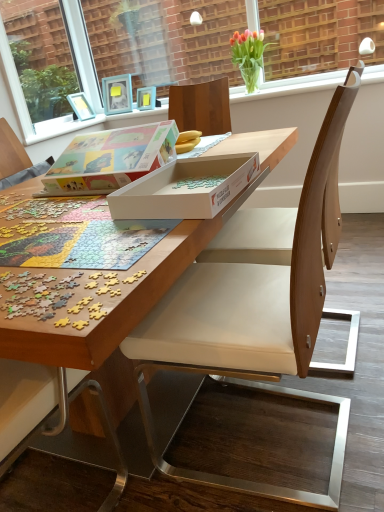
Question: Which direction should I rotate to look at clear glass vase at upper center, the first window screen viewed from the right, — up or down?

Choices:
 (A) up
 (B) down

Answer: (A)

Question: From the image's perspective, is translucent glass vase at upper center located beneath white cardboard box at center, marked as the 1th box in a front-to-back arrangement?

Choices:
 (A) no
 (B) yes

Answer: (A)

Question: Does translucent glass vase at upper center have a greater width compared to white cardboard box at center, marked as the second box in a back-to-front arrangement?

Choices:
 (A) no
 (B) yes

Answer: (A)

Question: Does translucent glass vase at upper center come in front of white cardboard box at center, marked as the 1th box in a front-to-back arrangement?

Choices:
 (A) no
 (B) yes

Answer: (A)

Question: From the image's perspective, does translucent glass vase at upper center appear higher than white cardboard box at center, marked as the second box in a back-to-front arrangement?

Choices:
 (A) no
 (B) yes

Answer: (B)

Question: Can white cardboard box at center, marked as the second box in a back-to-front arrangement, be found inside translucent glass vase at upper center?

Choices:
 (A) no
 (B) yes

Answer: (A)

Question: From a real-world perspective, is translucent glass vase at upper center positioned over white cardboard box at center, marked as the second box in a back-to-front arrangement, based on gravity?

Choices:
 (A) yes
 (B) no

Answer: (A)

Question: Is wooden puzzle at center positioned far away from clear glass window screen at upper left, marked as the 2th window screen in a right-to-left arrangement?

Choices:
 (A) yes
 (B) no

Answer: (A)

Question: Can you confirm if wooden puzzle at center is shorter than clear glass window screen at upper left, marked as the 2th window screen in a right-to-left arrangement?

Choices:
 (A) yes
 (B) no

Answer: (A)

Question: Is wooden puzzle at center to the left of clear glass window screen at upper left, marked as the 2th window screen in a right-to-left arrangement, from the viewer's perspective?

Choices:
 (A) no
 (B) yes

Answer: (A)

Question: Is wooden puzzle at center bigger than clear glass window screen at upper left, positioned as the first window screen in left-to-right order?

Choices:
 (A) yes
 (B) no

Answer: (A)

Question: Is wooden puzzle at center taller than clear glass window screen at upper left, positioned as the first window screen in left-to-right order?

Choices:
 (A) no
 (B) yes

Answer: (A)

Question: From a real-world perspective, does wooden puzzle at center sit lower than clear glass window screen at upper left, marked as the 2th window screen in a right-to-left arrangement?

Choices:
 (A) yes
 (B) no

Answer: (A)

Question: Is light brown wood chair at center further to the viewer compared to white cardboard box at center, marked as the second box in a back-to-front arrangement?

Choices:
 (A) no
 (B) yes

Answer: (B)